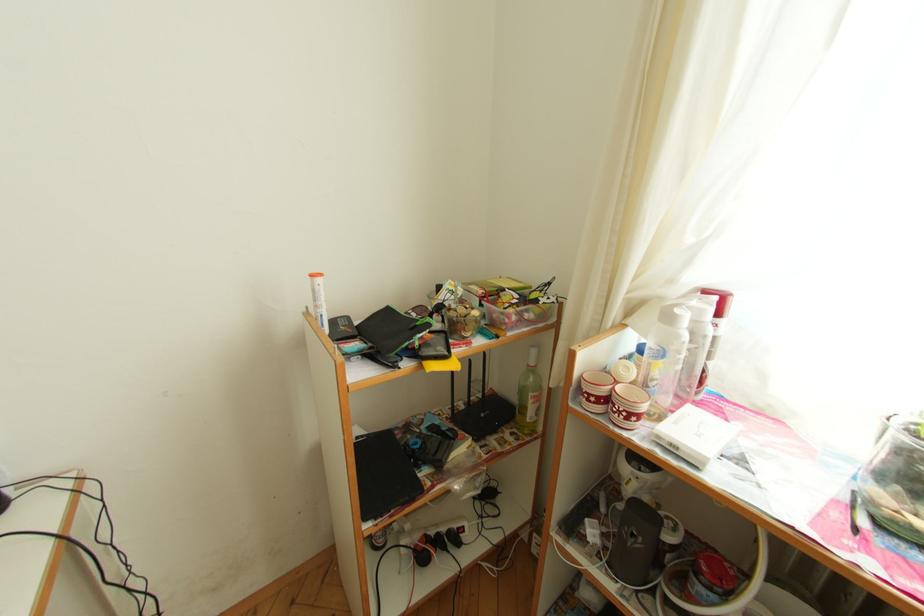
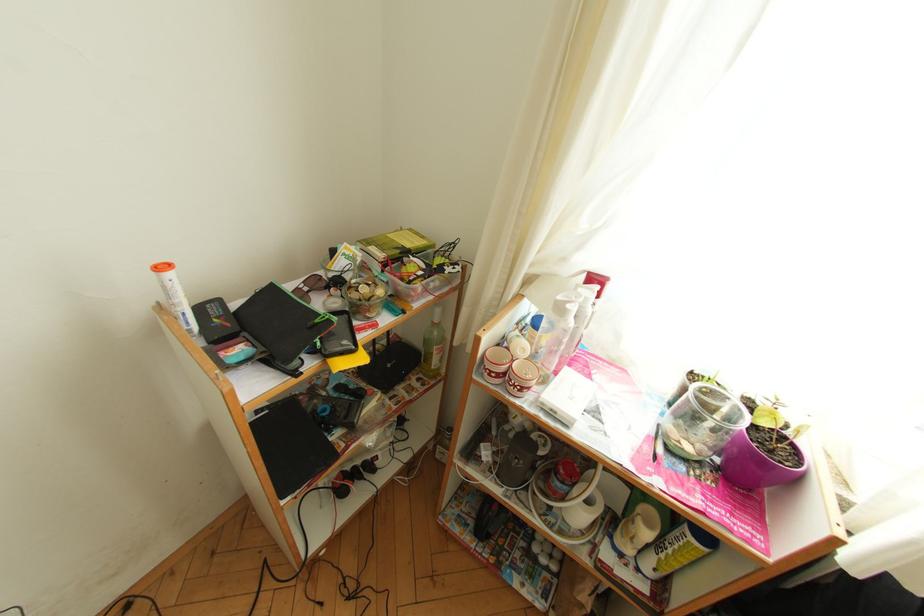
The first image is from the beginning of the video and the second image is from the end. How did the camera likely rotate when shooting the video?

The rotation direction of the camera is right-down.